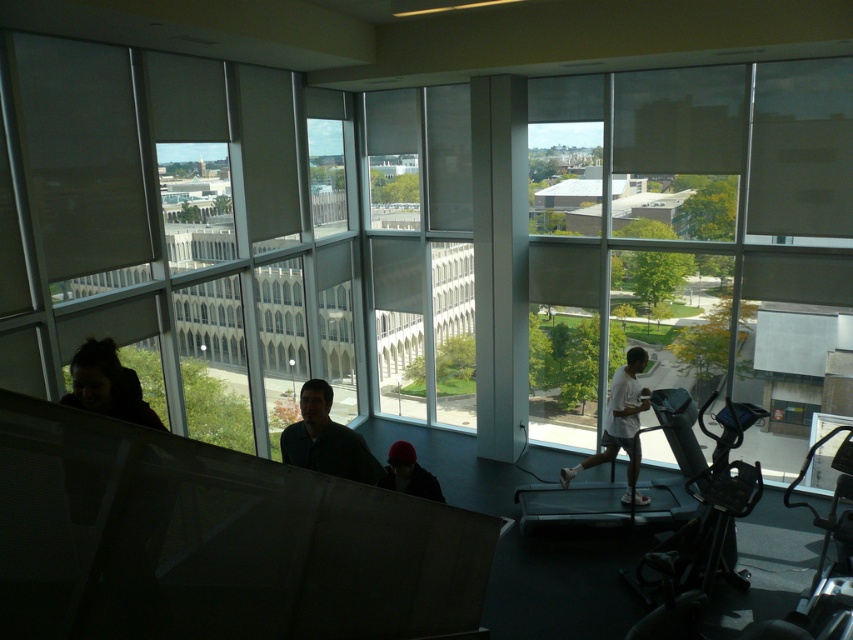
Is point (311, 401) in front of point (635, 387)?

Yes, point (311, 401) is closer to viewer.

From the picture: Which is more to the left, dark blue shirt at center or white matte shirt at center?

Positioned to the left is dark blue shirt at center.

Where is `dark blue shirt at center`? dark blue shirt at center is located at coordinates (326, 440).

Can you confirm if white matte shirt at center is shorter than dark blue knit cap at center?

Incorrect, white matte shirt at center's height does not fall short of dark blue knit cap at center's.

From the picture: Between white matte shirt at center and dark blue knit cap at center, which one appears on the left side from the viewer's perspective?

dark blue knit cap at center is more to the left.

Which is behind, point (627, 397) or point (413, 477)?

Positioned behind is point (627, 397).

At what (x,y) coordinates should I click in order to perform the action: click on white matte shirt at center. Please return your answer as a coordinate pair (x, y). Image resolution: width=853 pixels, height=640 pixels. Looking at the image, I should click on (619, 424).

Who is positioned more to the right, dark blue shirt at center or dark blue knit cap at center?

From the viewer's perspective, dark blue knit cap at center appears more on the right side.

Is point (303, 440) positioned after point (416, 493)?

No, it is not.

Is point (346, 436) more distant than point (404, 467)?

No, it is not.

You are a GUI agent. You are given a task and a screenshot of the screen. Output one action in this format:
    pyautogui.click(x=<x>, y=<y>)
    Task: Click on the dark blue shirt at center
    The width and height of the screenshot is (853, 640).
    Given the screenshot: What is the action you would take?
    pyautogui.click(x=326, y=440)